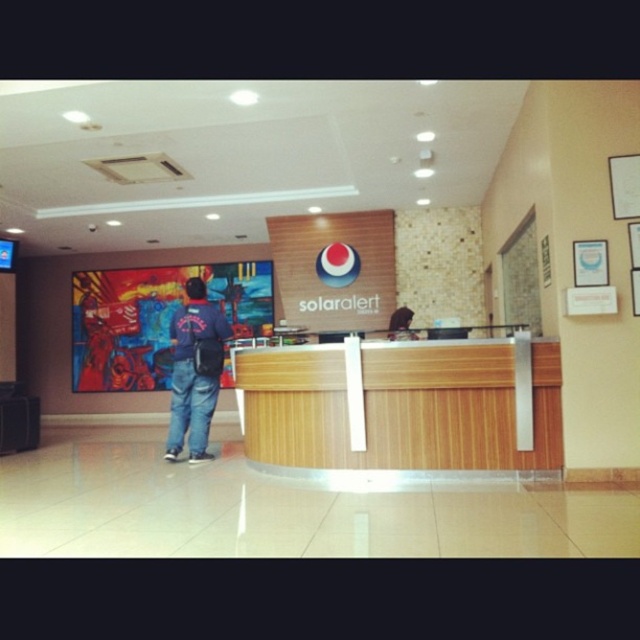
Question: Estimate the real-world distances between objects in this image. Which object is closer to the wooden/textured reception desk at center?

Choices:
 (A) denim jacket at center
 (B) wooden reception desk at center

Answer: (B)

Question: Estimate the real-world distances between objects in this image. Which object is farther from the wooden/textured reception desk at center?

Choices:
 (A) denim jacket at center
 (B) wooden reception desk at center

Answer: (A)

Question: Is wooden reception desk at center above denim jacket at center?

Choices:
 (A) no
 (B) yes

Answer: (B)

Question: Which of these objects is positioned closest to the denim jacket at center?

Choices:
 (A) wooden/textured reception desk at center
 (B) wooden reception desk at center

Answer: (A)

Question: Can you confirm if wooden/textured reception desk at center is thinner than denim jacket at center?

Choices:
 (A) yes
 (B) no

Answer: (B)

Question: Is wooden reception desk at center closer to the viewer compared to wooden/textured reception desk at center?

Choices:
 (A) no
 (B) yes

Answer: (B)